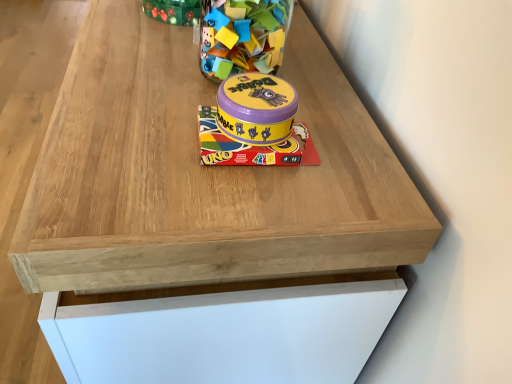
Where is `vacant region to the left of matte purple tin at center, the 2th toy in the back-to-front sequence`? This screenshot has width=512, height=384. vacant region to the left of matte purple tin at center, the 2th toy in the back-to-front sequence is located at coordinates (136, 112).